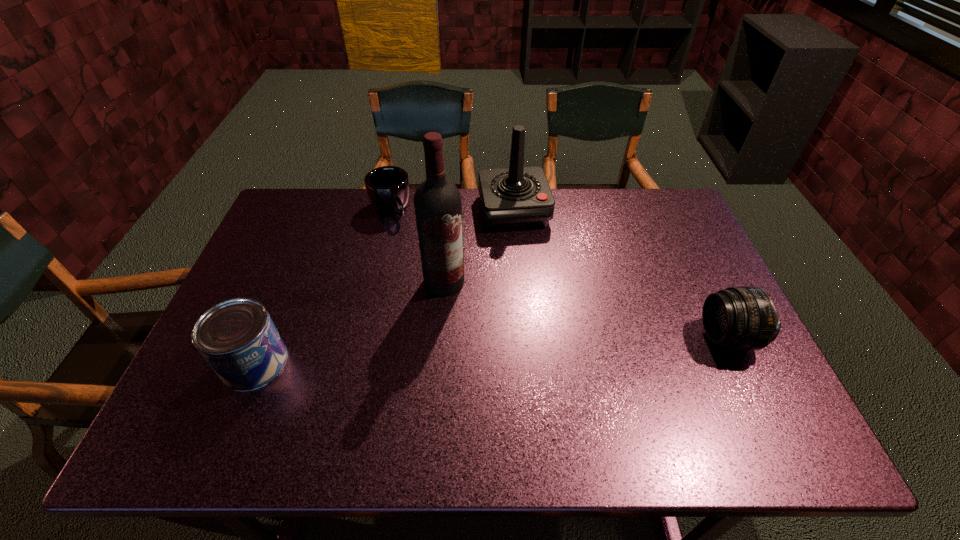
Locate an element on the screen. The image size is (960, 540). free region that satisfies the following two spatial constraints: 1. on the front side of the fourth object from left to right; 2. on the right side of the fourth object from right to left is located at coordinates (390, 210).